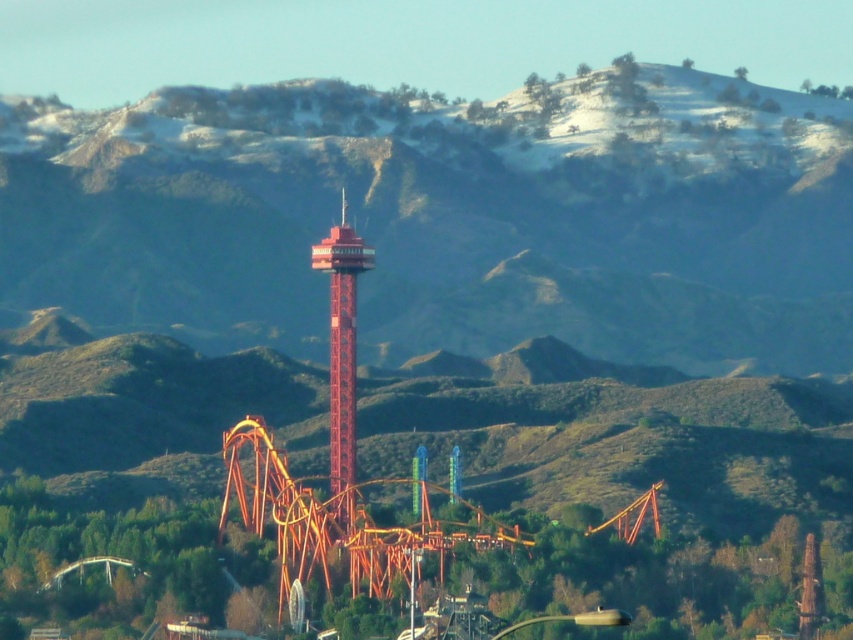
Does smooth brown mountain at center lie behind smooth red tower at center?

No, smooth brown mountain at center is closer to the viewer.

Image resolution: width=853 pixels, height=640 pixels. In order to click on smooth brown mountain at center in this screenshot , I will do `click(448, 216)`.